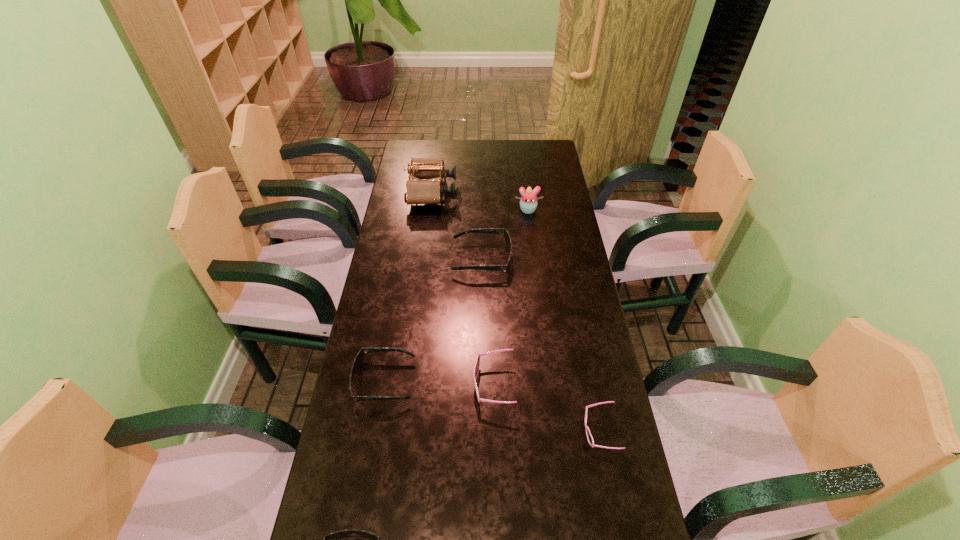
You are a GUI agent. You are given a task and a screenshot of the screen. Output one action in this format:
    pyautogui.click(x=<x>, y=<y>)
    Task: Click on the free spot located 0.220m on the face of the cupcake
    
    Given the screenshot: What is the action you would take?
    pyautogui.click(x=533, y=253)

Where is `free space located 0.140m on the front-facing side of the rightmost black sunglasses`? The height and width of the screenshot is (540, 960). free space located 0.140m on the front-facing side of the rightmost black sunglasses is located at coordinates (414, 259).

Where is `free space located 0.120m on the front-facing side of the rightmost black sunglasses`? free space located 0.120m on the front-facing side of the rightmost black sunglasses is located at coordinates (420, 259).

The image size is (960, 540). In order to click on vacant space situated 0.220m on the front-facing side of the rightmost black sunglasses in this screenshot , I will do `click(392, 259)`.

The height and width of the screenshot is (540, 960). Identify the location of vacant position located on the front-facing side of the left pink sunglasses. (376, 385).

Where is `free space located on the front-facing side of the left pink sunglasses`? The height and width of the screenshot is (540, 960). free space located on the front-facing side of the left pink sunglasses is located at coordinates (362, 385).

What are the coordinates of `free space located 0.170m on the front-facing side of the left pink sunglasses` in the screenshot? It's located at (413, 385).

Locate an element on the screen. free spot located 0.240m on the front-facing side of the second biggest black sunglasses is located at coordinates (499, 381).

This screenshot has height=540, width=960. I want to click on vacant space located 0.070m on the front-facing side of the smaller pink sunglasses, so click(x=556, y=431).

Find the location of a particular element. This screenshot has width=960, height=540. blank area located 0.140m on the front-facing side of the smaller pink sunglasses is located at coordinates (529, 431).